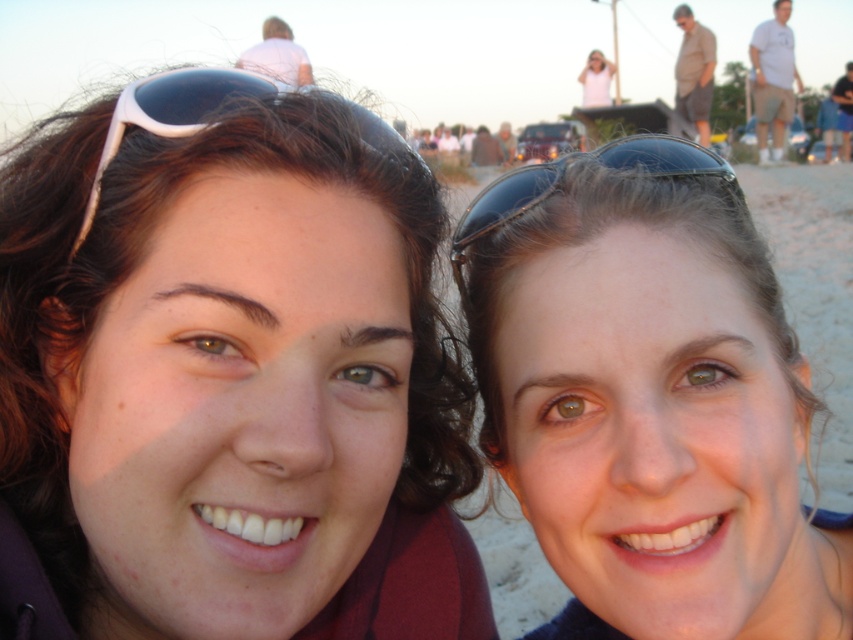
You are a photographer trying to capture a closeup of the white plastic sunglasses at upper left in the image. The photographer is positioned at the center of the image. Which direction should you move your camera to get a better shot?

Since the white plastic sunglasses at upper left is located at point (173, 112), the photographer should move the camera to the upper left direction to capture a closer shot.

You are a photographer trying to capture a closeup shot of the white plastic sunglasses at upper left and the gray fabric shirt at upper right in the image. Which object should you zoom in on more to ensure both are clearly visible in the frame?

The white plastic sunglasses at upper left occupies less space than the gray fabric shirt at upper right, so you should zoom in more on the gray fabric shirt at upper right to ensure both are clearly visible in the frame.

You are a photographer trying to capture a clear shot of both the matte black sunglasses at upper left and the black matte sunglasses at upper center. However, you notice one is blocking the view of the other. Which sunglasses are being obscured by the other?

The matte black sunglasses at upper left is positioned under the black matte sunglasses at upper center, so it is being obscured by the black matte sunglasses at upper center.